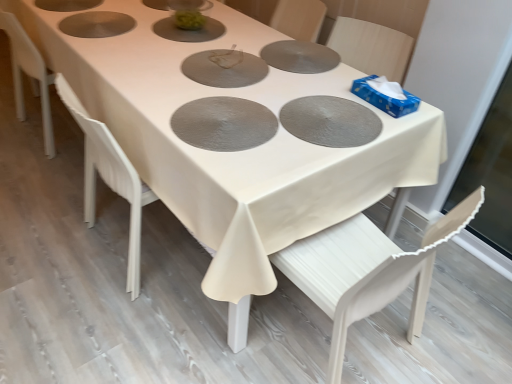
This screenshot has width=512, height=384. What are the coordinates of `vacant space in front of textured silver pizza pan at center, arranged as the first pizza pan when ordered from the bottom` in the screenshot? It's located at (233, 164).